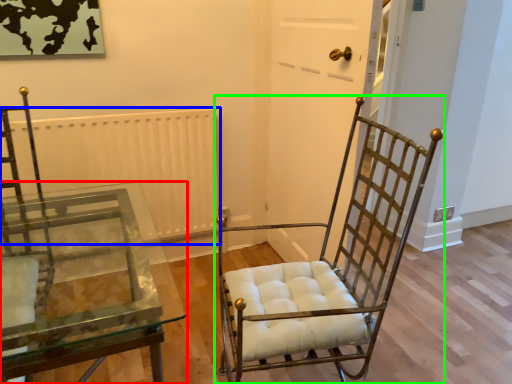
Question: Considering the real-world distances, which object is farthest from table (highlighted by a red box)? radiator (highlighted by a blue box) or chair (highlighted by a green box)?

Choices:
 (A) radiator
 (B) chair

Answer: (B)